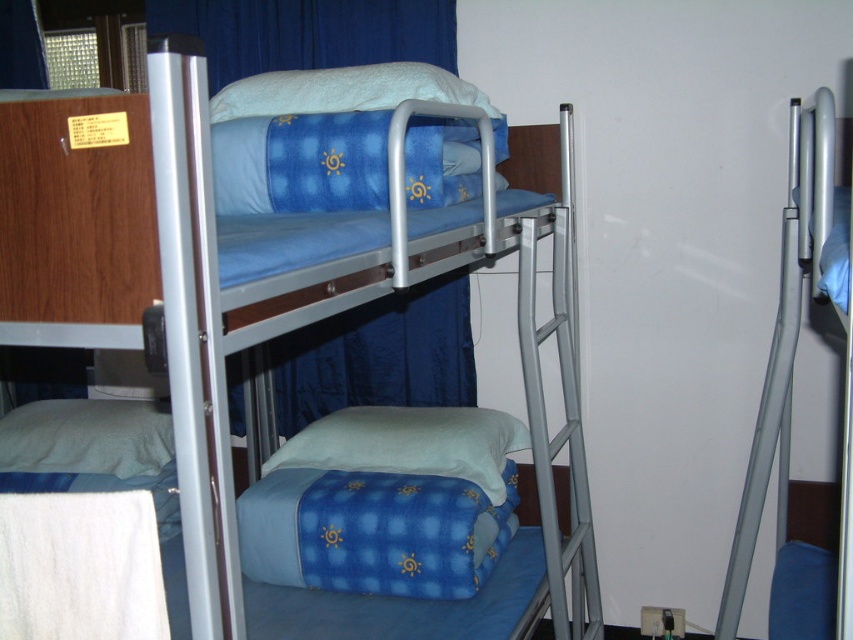
You are in a room with two bunk beds. You see a blue fabric curtain at center and a white soft pillow at lower left. From the perspective of someone standing at the foot of the lower bed, which object is on the right side?

The blue fabric curtain at center is on the right side of the white soft pillow at lower left.

From the picture: You are standing in the room and want to locate the blue fabric curtain at upper center. What are its coordinates?

The blue fabric curtain at upper center is located at coordinates point (x=306, y=33).

You are trying to hang a new decoration between the blue fabric curtain at upper center and the soft blue fabric pillow at center. Since you want it to be closer to you, which object should you place it near?

The blue fabric curtain at upper center is closer to you than the soft blue fabric pillow at center, so you should place the decoration near the blue fabric curtain at upper center.